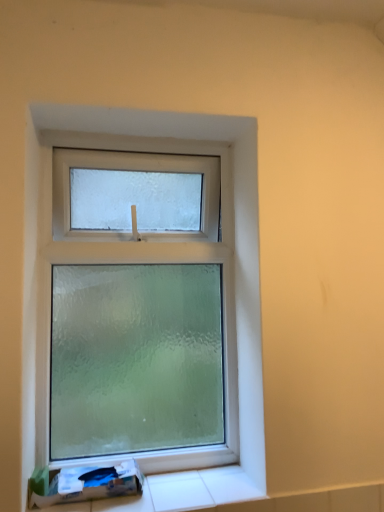
Where is `frosted glass window at center`? The width and height of the screenshot is (384, 512). frosted glass window at center is located at coordinates (147, 251).

What do you see at coordinates (147, 251) in the screenshot?
I see `frosted glass window at center` at bounding box center [147, 251].

Find the location of `frosted glass window at center`. frosted glass window at center is located at coordinates (147, 251).